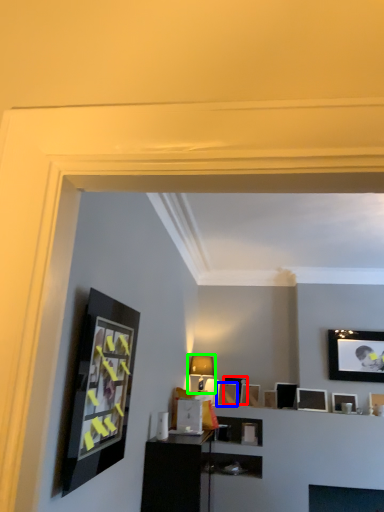
Question: Based on their relative distances, which object is farther from picture frame (highlighted by a red box)? Choose from picture frame (highlighted by a blue box) and lamp (highlighted by a green box).

Choices:
 (A) picture frame
 (B) lamp

Answer: (B)